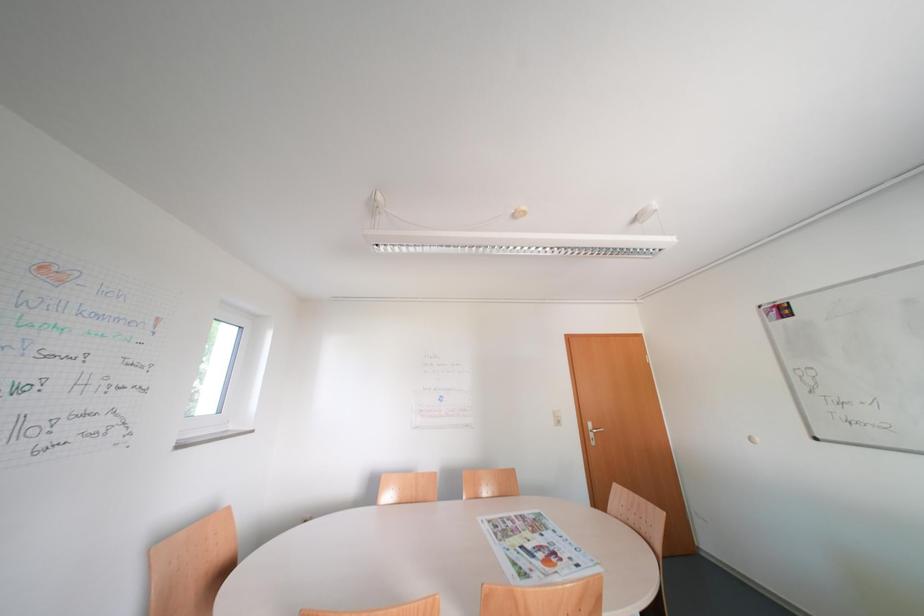
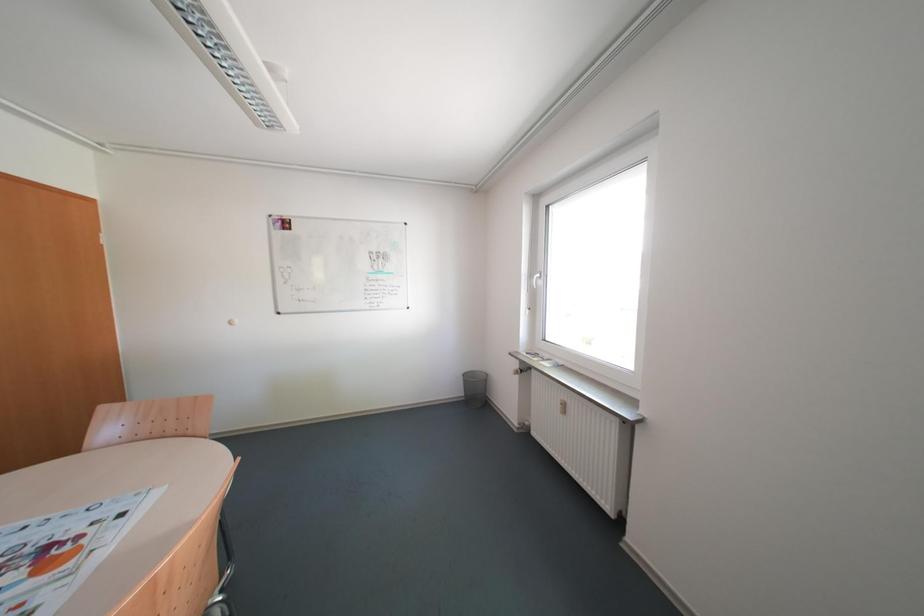
Question: The camera is either moving clockwise (left) or counter-clockwise (right) around the object. The first image is from the beginning of the video and the second image is from the end. Is the camera moving left or right when shooting the video?

Choices:
 (A) Left
 (B) Right

Answer: (A)